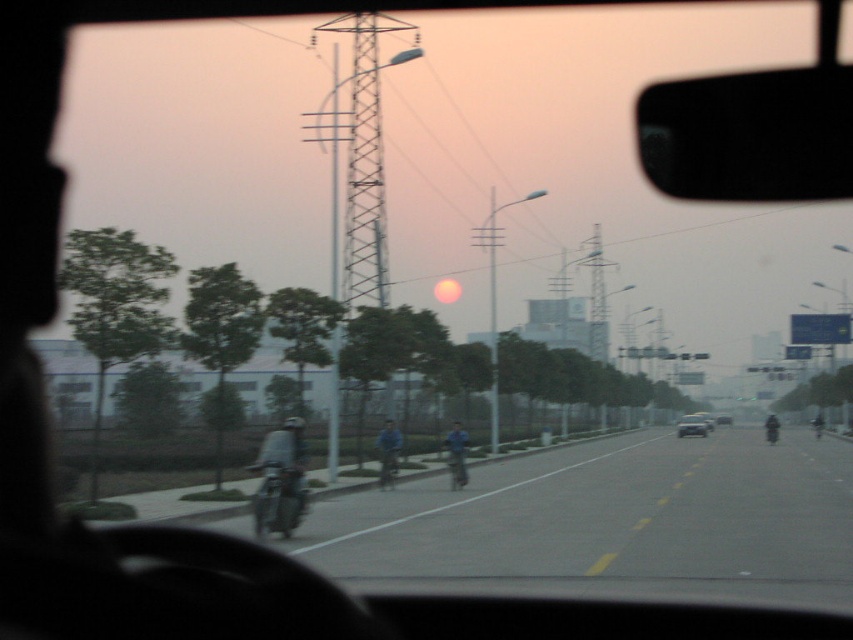
Question: Does black glossy view mirror at upper right appear on the right side of metallic silver bicycle at center?

Choices:
 (A) no
 (B) yes

Answer: (B)

Question: Is dark gray helmeted rider at center-left smaller than metallic silver bicycle at center?

Choices:
 (A) yes
 (B) no

Answer: (B)

Question: Among these objects, which one is farthest from the camera?

Choices:
 (A) blue matte jacket at center
 (B) metallic silver car at center

Answer: (B)

Question: Among these objects, which one is nearest to the camera?

Choices:
 (A) dark blue helmet at center
 (B) dark blue fabric jacket at center
 (C) black glossy view mirror at upper right

Answer: (C)

Question: Is dark gray helmeted rider at center-left thinner than blue fabric jacket at center?

Choices:
 (A) no
 (B) yes

Answer: (A)

Question: Which of the following is the closest to the observer?

Choices:
 (A) coord(680,433)
 (B) coord(271,467)
 (C) coord(724,99)

Answer: (C)